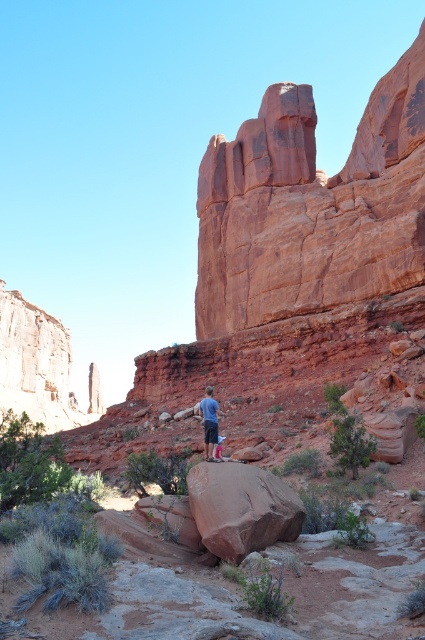
You are a photographer planning to capture a dramatic landscape photo of the rustic sandstone rock formation at upper center and the matte blue shirt at center. Since you want the rock formation to stand out more, which object should you focus on to ensure it appears larger in the photo?

The rustic sandstone rock formation at upper center has a greater height compared to the matte blue shirt at center, so focusing on the rustic sandstone rock formation at upper center will make it appear larger in the photo.

You are standing on the rustic sandstone boulder at center and want to take a photo of the rustic sandstone rock formation at upper center. In which direction should you point your camera to capture it?

You should point your camera to the right since the rustic sandstone rock formation at upper center is located to the right of the rustic sandstone boulder at center.

You are a photographer planning to capture a landscape shot of the desert scene. You have a camera with a 35mm lens and want to include both the rustic sandstone boulder at center and the matte blue shirt at center in your frame. Given the lens specifications, will the width of the boulder allow both objects to fit within the frame?

The rustic sandstone boulder at center is wider than the matte blue shirt at center. Since the 35mm lens has a standard field of view, both objects can fit in the frame as long as they are positioned within the camera sensor area. However, the exact composition depends on the distance from the camera to the subjects.